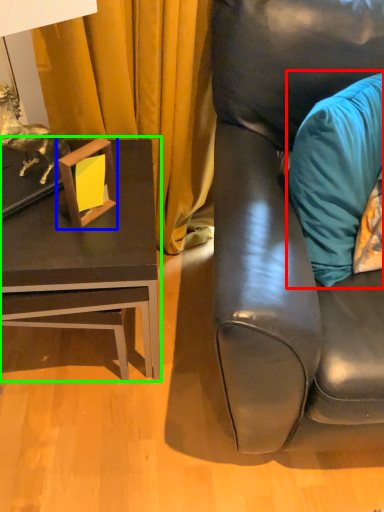
Question: Based on their relative distances, which object is farther from pillow (highlighted by a red box)? Choose from picture frame (highlighted by a blue box) and table (highlighted by a green box).

Choices:
 (A) picture frame
 (B) table

Answer: (A)